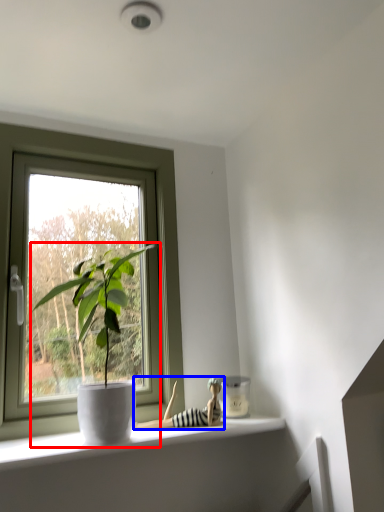
Question: Which point is further to the camera, houseplant (highlighted by a red box) or toy (highlighted by a blue box)?

Choices:
 (A) houseplant
 (B) toy

Answer: (B)